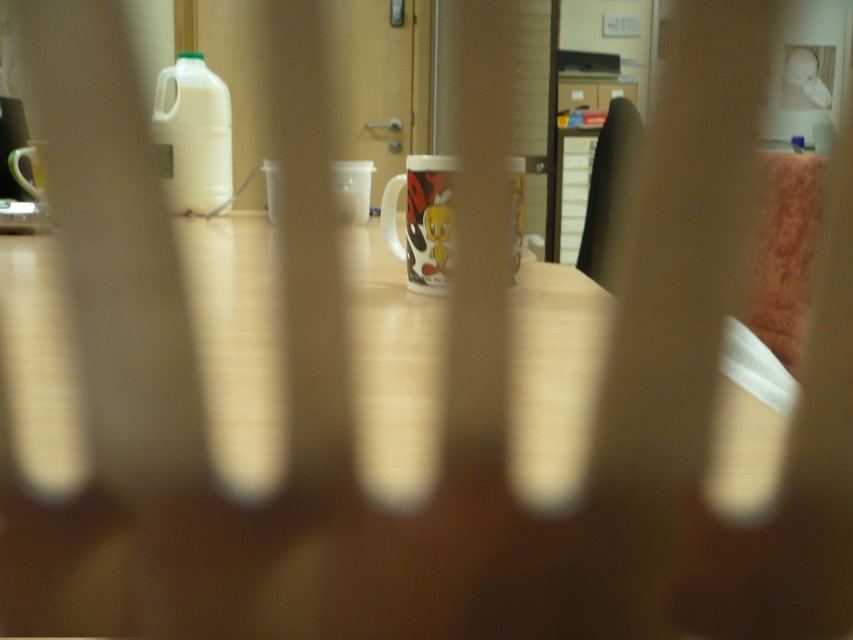
Question: Can you confirm if brown leather chair at right is positioned above matte white mug at left?

Choices:
 (A) no
 (B) yes

Answer: (B)

Question: Which object is closer to the camera taking this photo?

Choices:
 (A) wooden table at center
 (B) brown leather chair at right
 (C) glossy ceramic mug at center

Answer: (A)

Question: Is wooden table at center above brown leather chair at right?

Choices:
 (A) yes
 (B) no

Answer: (B)

Question: Is wooden table at center above brown leather chair at right?

Choices:
 (A) no
 (B) yes

Answer: (A)

Question: Which object is the closest to the matte white mug at left?

Choices:
 (A) brown leather chair at right
 (B) glossy ceramic mug at center

Answer: (B)

Question: Among these objects, which one is nearest to the camera?

Choices:
 (A) brown leather chair at right
 (B) glossy ceramic mug at center
 (C) wooden table at center
 (D) matte white mug at left

Answer: (C)